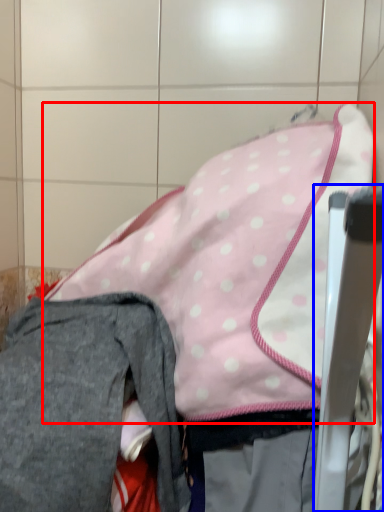
Question: Which point is closer to the camera, wide (highlighted by a red box) or chair (highlighted by a blue box)?

Choices:
 (A) wide
 (B) chair

Answer: (B)